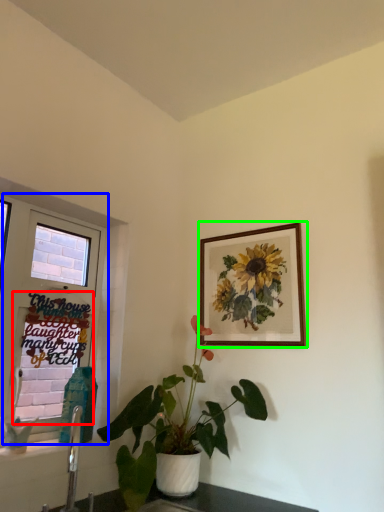
Question: Which is nearer to the window screen (highlighted by a red box)? window (highlighted by a blue box) or picture frame (highlighted by a green box).

Choices:
 (A) window
 (B) picture frame

Answer: (A)